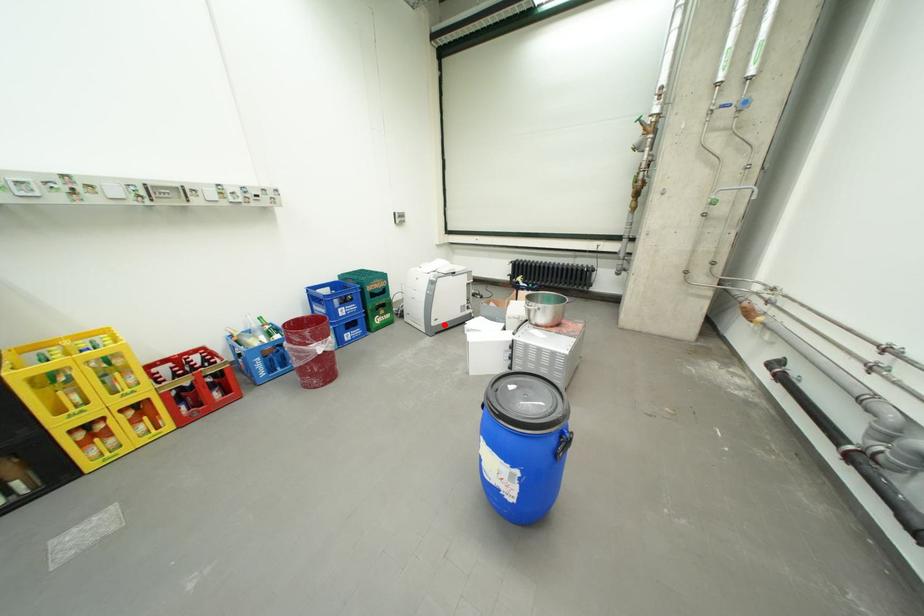
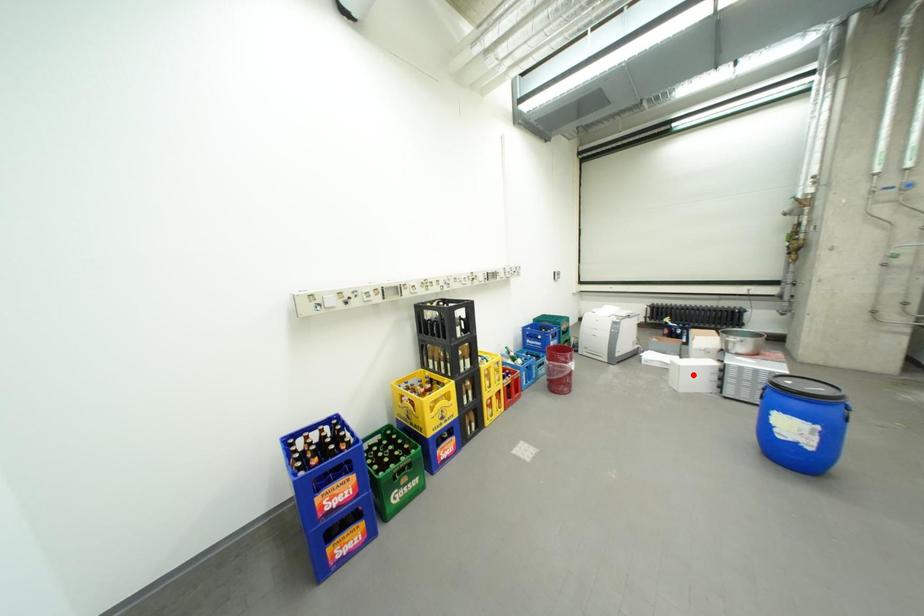
I am providing you with two images of the same scene from different viewpoints. A red point is marked on the first image and another point is marked on the second image. Does the point marked in image1 correspond to the same location as the one in image2?

No